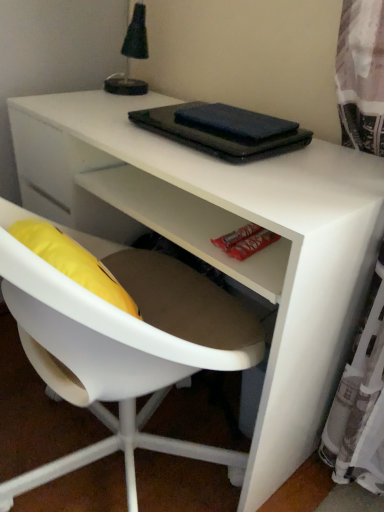
The height and width of the screenshot is (512, 384). I want to click on space that is in front of dark blue matte notebook at upper center, the second notebook positioned from the bottom, so click(x=259, y=167).